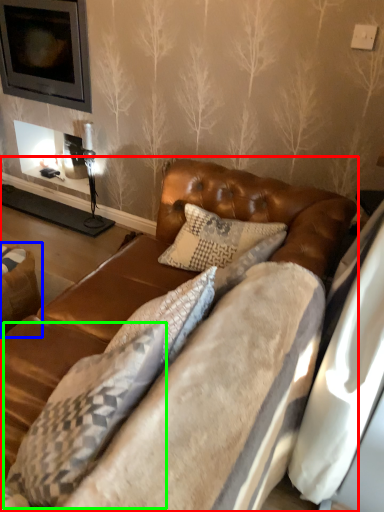
Question: Which is nearer to the studio couch (highlighted by a red box)? swivel chair (highlighted by a blue box) or pillow (highlighted by a green box).

Choices:
 (A) swivel chair
 (B) pillow

Answer: (B)